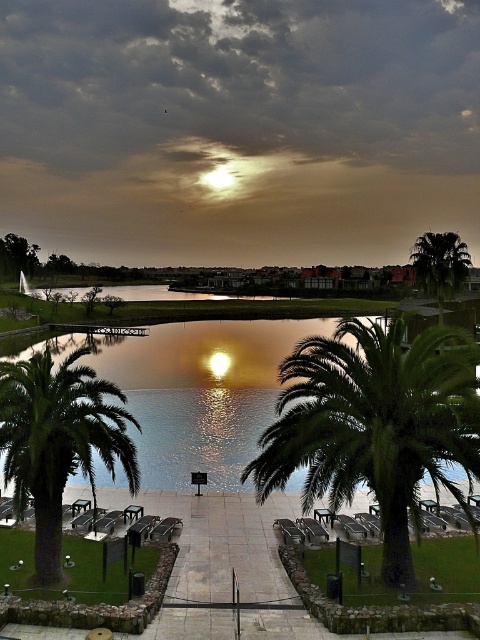
Is green leafy palm tree at center to the left of smooth concrete path at center from the viewer's perspective?

In fact, green leafy palm tree at center is to the right of smooth concrete path at center.

Image resolution: width=480 pixels, height=640 pixels. Describe the element at coordinates (374, 424) in the screenshot. I see `green leafy palm tree at center` at that location.

This screenshot has height=640, width=480. Identify the location of green leafy palm tree at center. (374, 424).

Between point (33, 420) and point (145, 637), which one is positioned behind?

The point (33, 420) is more distant.

From the picture: Which is more to the right, green leafy palm tree at lower left or smooth concrete path at center?

smooth concrete path at center is more to the right.

The image size is (480, 640). What do you see at coordinates (58, 442) in the screenshot?
I see `green leafy palm tree at lower left` at bounding box center [58, 442].

Identify the location of green leafy palm tree at lower left. This screenshot has height=640, width=480. (58, 442).

Does point (375, 412) come in front of point (414, 266)?

Yes.

Who is more distant from viewer, (291, 397) or (443, 240)?

The point (443, 240) is more distant.

Is point (374, 380) closer to viewer compared to point (425, 285)?

Yes.

Locate an element on the screen. The height and width of the screenshot is (640, 480). green leafy palm tree at center is located at coordinates (374, 424).